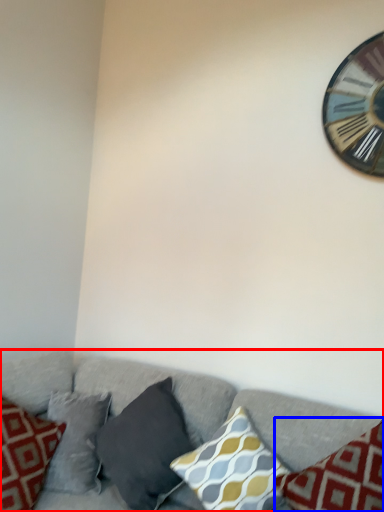
Question: Among these objects, which one is farthest to the camera, studio couch (highlighted by a red box) or pillow (highlighted by a blue box)?

Choices:
 (A) studio couch
 (B) pillow

Answer: (B)